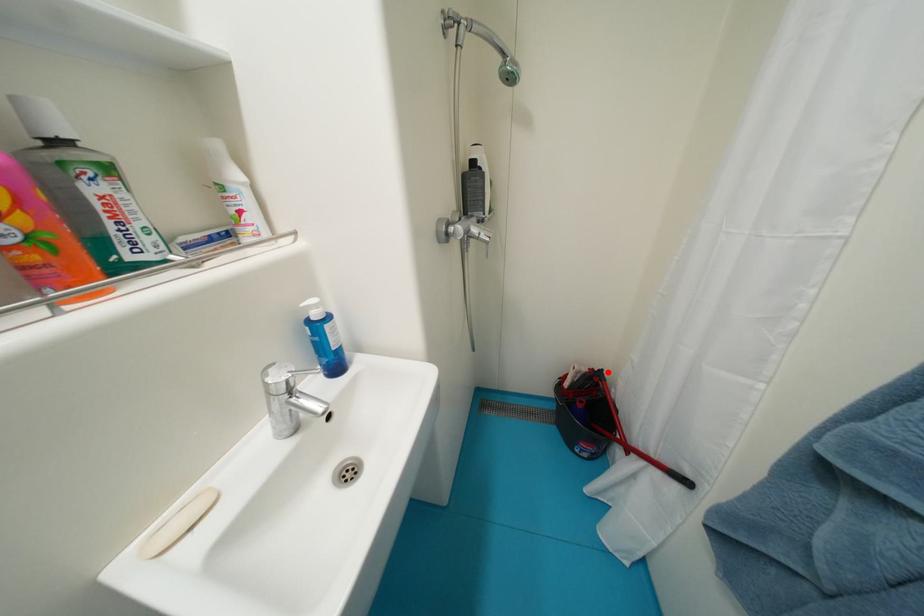
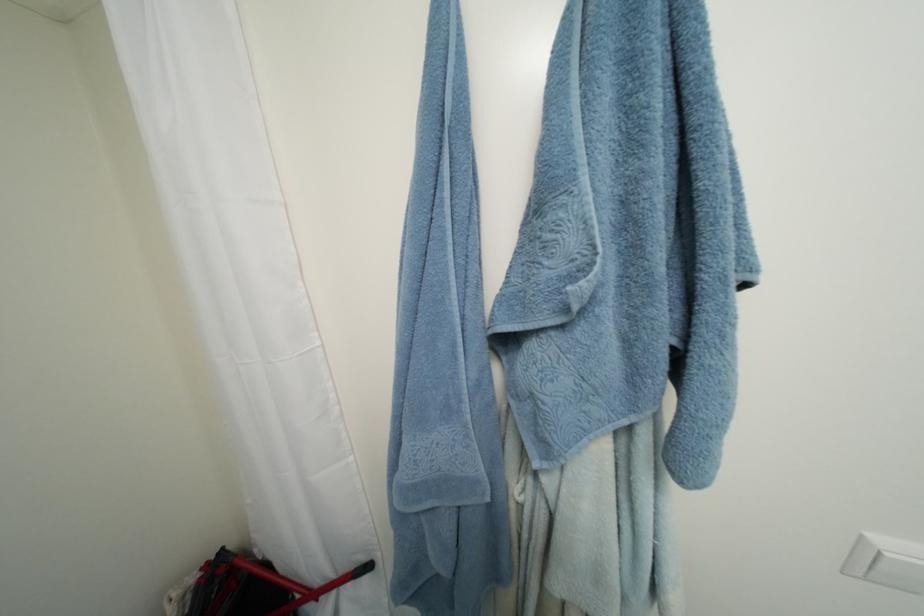
Where in the second image is the point corresponding to the highlighted location from the first image?

(229, 552)